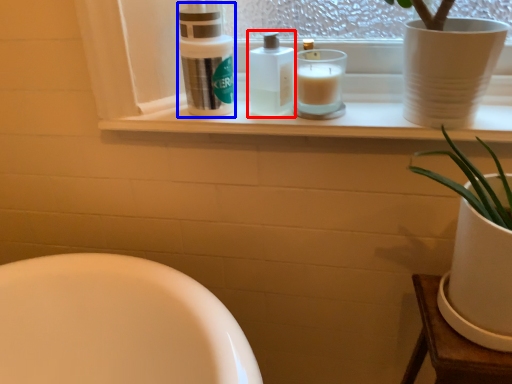
Question: Which point is further to the camera, toiletry (highlighted by a red box) or cleaning product (highlighted by a blue box)?

Choices:
 (A) toiletry
 (B) cleaning product

Answer: (A)